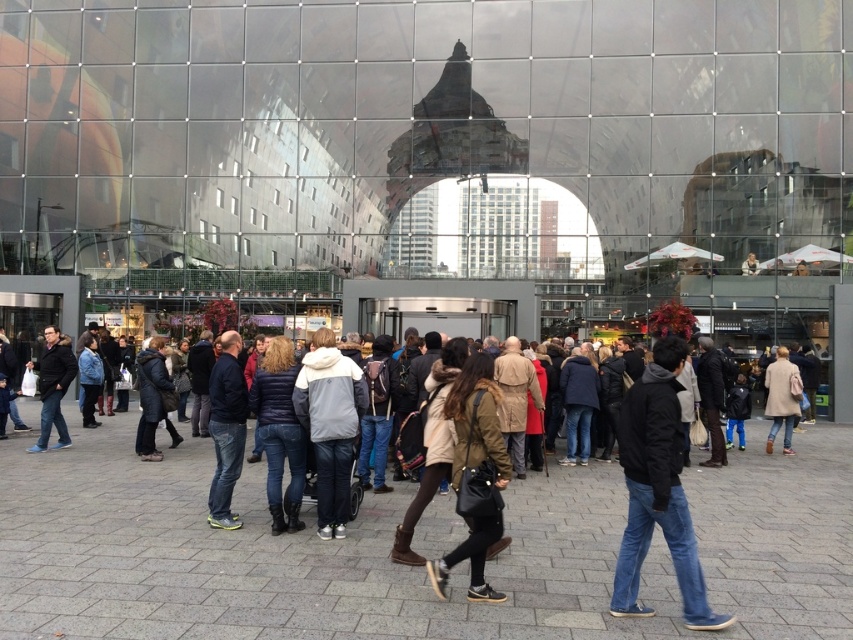
You are a photographer trying to capture the reflection of the two dark blue jackets in the glass facade of the building. Which of the two jackets, the dark blue quilted jacket at center or the dark blue jacket at center, will appear higher in the reflection?

The dark blue quilted jacket at center is below the dark blue jacket at center, so in the reflection, the dark blue jacket at center will appear higher than the dark blue quilted jacket at center.

You are standing at the point closest to the building entrance. There are two points marked in the scene, point A at coordinates point A is point (805, 540) and point B at coordinates point B is point (328, 378). Which point is farther from your current position?

Point A at coordinates point A is point (805, 540) is farther from your current position because it is behind point B at coordinates point B is point (328, 378), which is closer to the entrance.